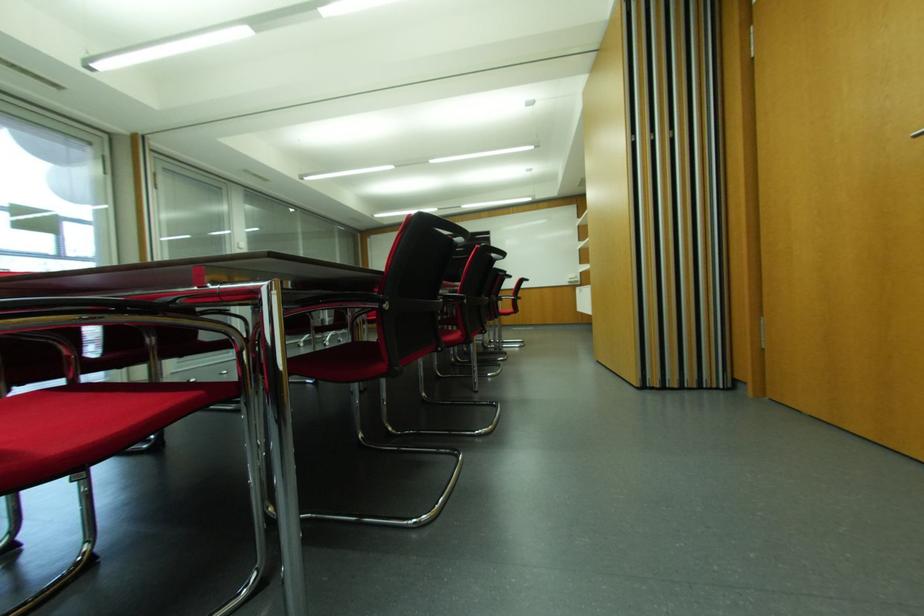
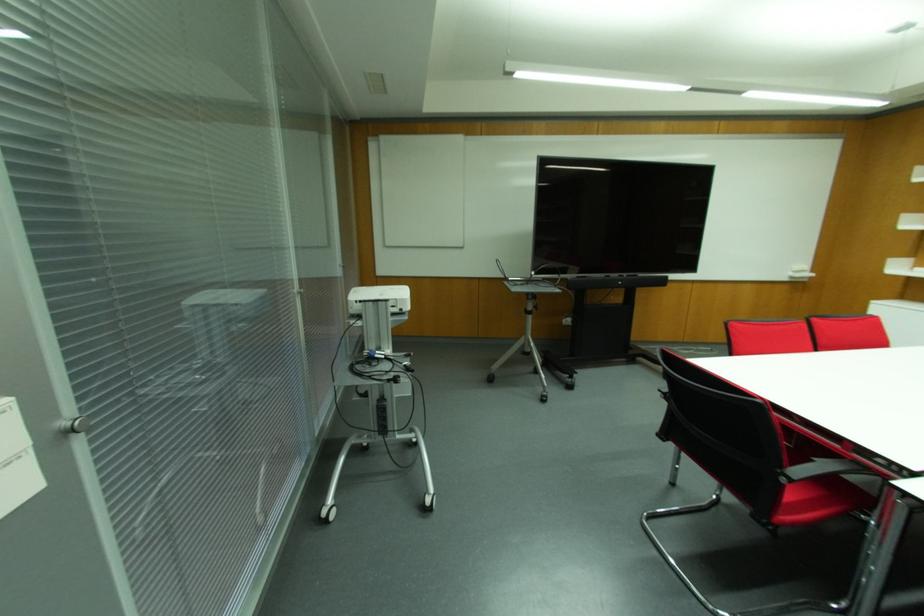
The point at (577, 278) is marked in the first image. Where is the corresponding point in the second image?

(811, 274)